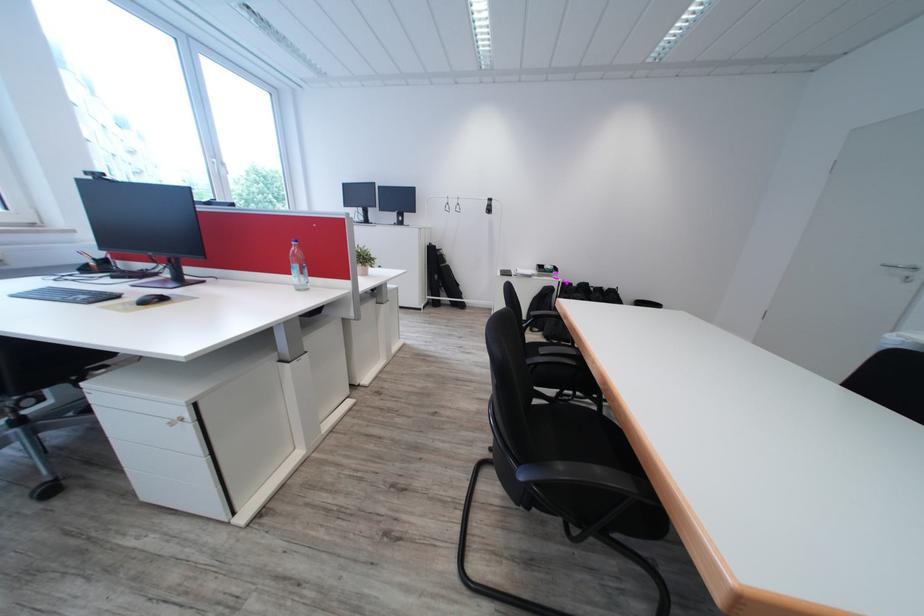
Identify the location of silver door handle. This screenshot has height=616, width=924. (901, 270).